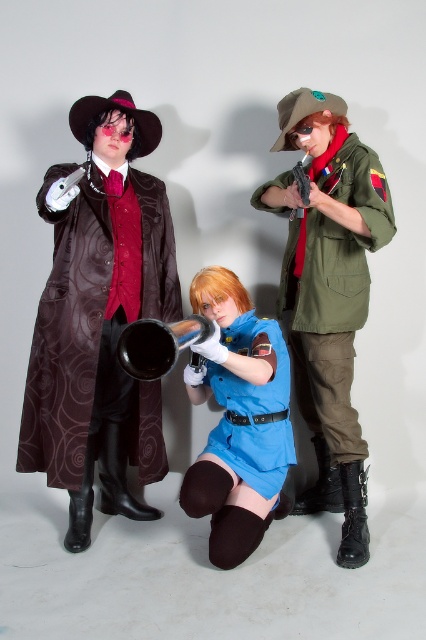
Question: Which point appears closest to the camera in this image?

Choices:
 (A) 342,196
 (B) 187,332
 (C) 224,307

Answer: (B)

Question: Which object is the farthest from the black metallic trumpet at center?

Choices:
 (A) shiny brown coat at left
 (B) green military jacket at center
 (C) light blue fabric vest at center

Answer: (B)

Question: Is green military jacket at center behind shiny brown coat at left?

Choices:
 (A) yes
 (B) no

Answer: (A)

Question: Which point is farther to the camera?

Choices:
 (A) (291, 246)
 (B) (71, 460)

Answer: (A)

Question: In this image, where is light blue fabric vest at center located relative to black metallic trumpet at center?

Choices:
 (A) right
 (B) left

Answer: (A)

Question: Is shiny brown coat at left wider than black metallic trumpet at center?

Choices:
 (A) yes
 (B) no

Answer: (A)